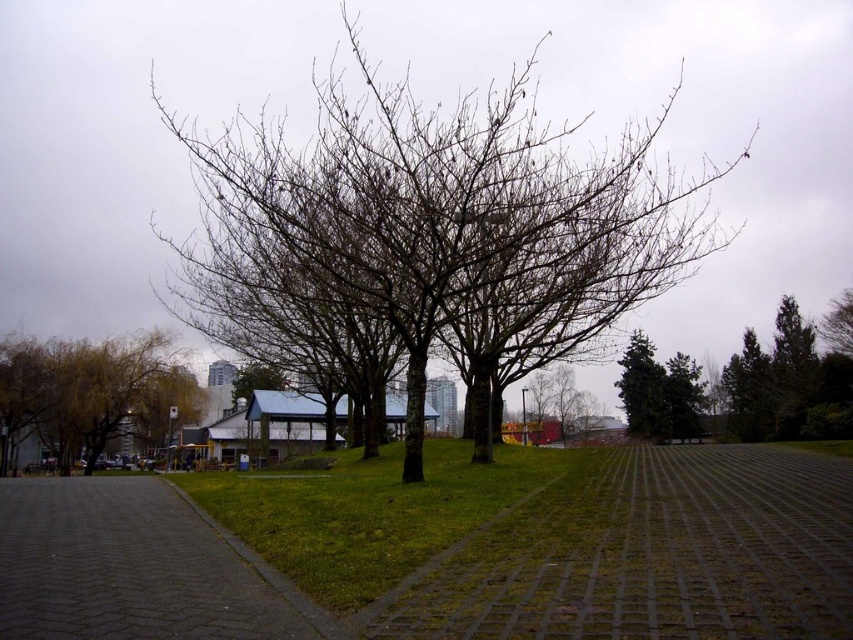
Measure the distance between gray concrete path at center and camera.

gray concrete path at center and camera are 4.50 meters apart.

Who is lower down, gray concrete path at center or green textured tree at upper right?

green textured tree at upper right

Who is more forward, (471, 560) or (663, 413)?

Positioned in front is point (471, 560).

Identify the location of gray concrete path at center. The width and height of the screenshot is (853, 640). (646, 554).

Between point (503, 152) and point (80, 580), which one is positioned in front?

Point (80, 580)

Is bare branches at center positioned behind dark gray cobblestone pavement at lower left?

Yes, bare branches at center is behind dark gray cobblestone pavement at lower left.

Who is more forward, (x=434, y=198) or (x=68, y=522)?

Point (x=68, y=522) is more forward.

You are a GUI agent. You are given a task and a screenshot of the screen. Output one action in this format:
    pyautogui.click(x=<x>, y=<y>)
    Task: Click on the bare branches at center
    The height and width of the screenshot is (640, 853).
    Given the screenshot: What is the action you would take?
    pyautogui.click(x=451, y=195)

Does dark gray cobblestone pavement at lower left appear on the left side of green grass at center?

Yes, dark gray cobblestone pavement at lower left is to the left of green grass at center.

Does dark gray cobblestone pavement at lower left appear on the right side of green grass at center?

Incorrect, dark gray cobblestone pavement at lower left is not on the right side of green grass at center.

The height and width of the screenshot is (640, 853). Describe the element at coordinates (126, 566) in the screenshot. I see `dark gray cobblestone pavement at lower left` at that location.

Locate an element on the screen. The height and width of the screenshot is (640, 853). dark gray cobblestone pavement at lower left is located at coordinates pyautogui.click(x=126, y=566).